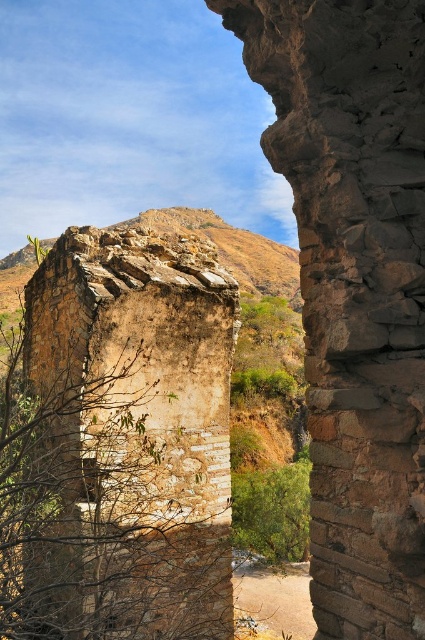
Question: Does brown rough stone wall at center appear over rustic stone tower at center?

Choices:
 (A) yes
 (B) no

Answer: (A)

Question: Which object is farther from the camera taking this photo?

Choices:
 (A) brown rough stone wall at center
 (B) rustic stone tower at center

Answer: (B)

Question: Does brown rough stone wall at center appear on the left side of rustic stone tower at center?

Choices:
 (A) no
 (B) yes

Answer: (A)

Question: Which of the following is the farthest from the observer?

Choices:
 (A) rustic stone tower at center
 (B) brown rough stone wall at center

Answer: (A)

Question: Among these points, which one is farthest from the camera?

Choices:
 (A) (184, 630)
 (B) (422, 93)

Answer: (A)

Question: Is brown rough stone wall at center smaller than rustic stone tower at center?

Choices:
 (A) yes
 (B) no

Answer: (A)